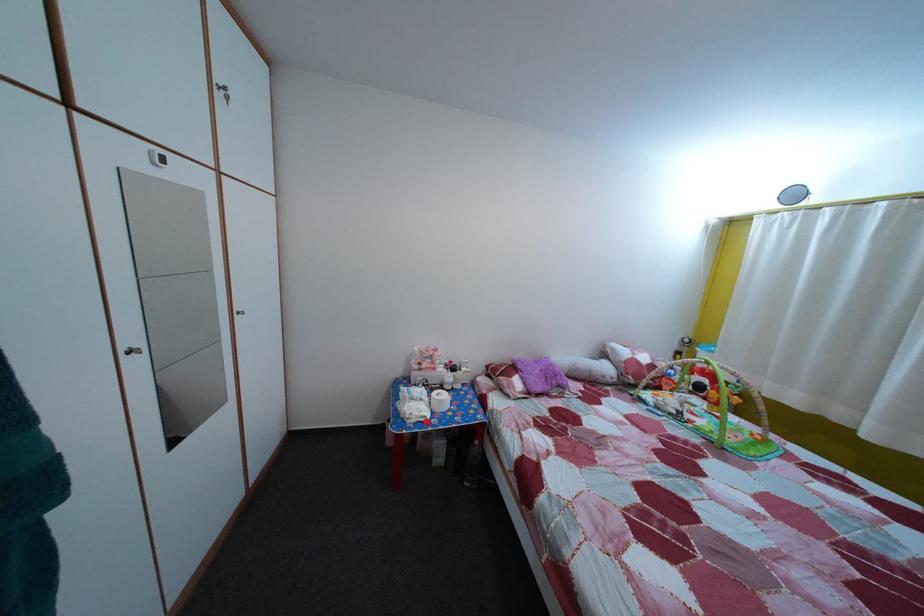
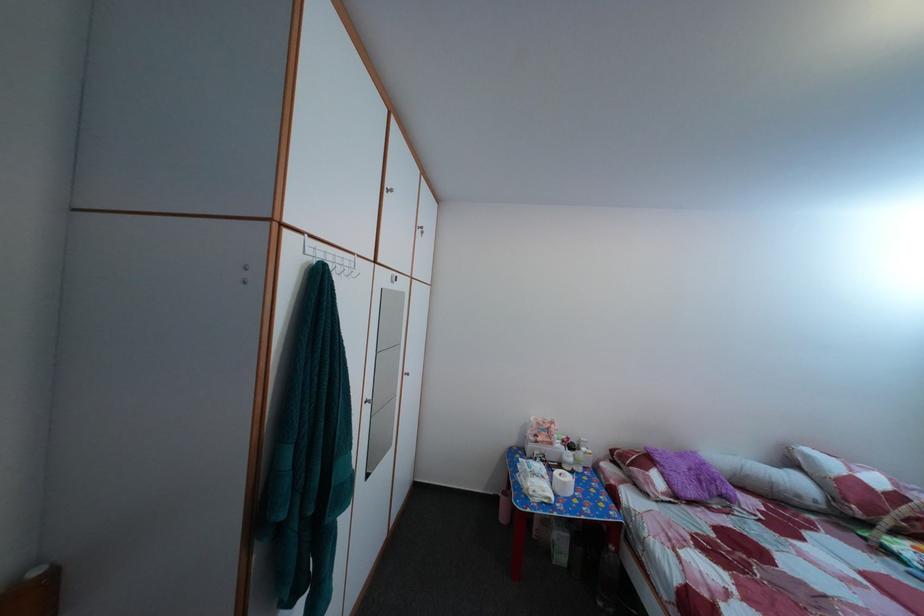
The point at the highlighted location is marked in the first image. Where is the corresponding point in the second image?

(551, 500)